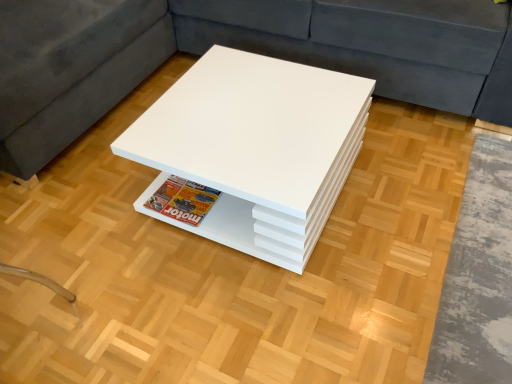
The image size is (512, 384). I want to click on vacant space to the left of white glossy table at center, so click(85, 224).